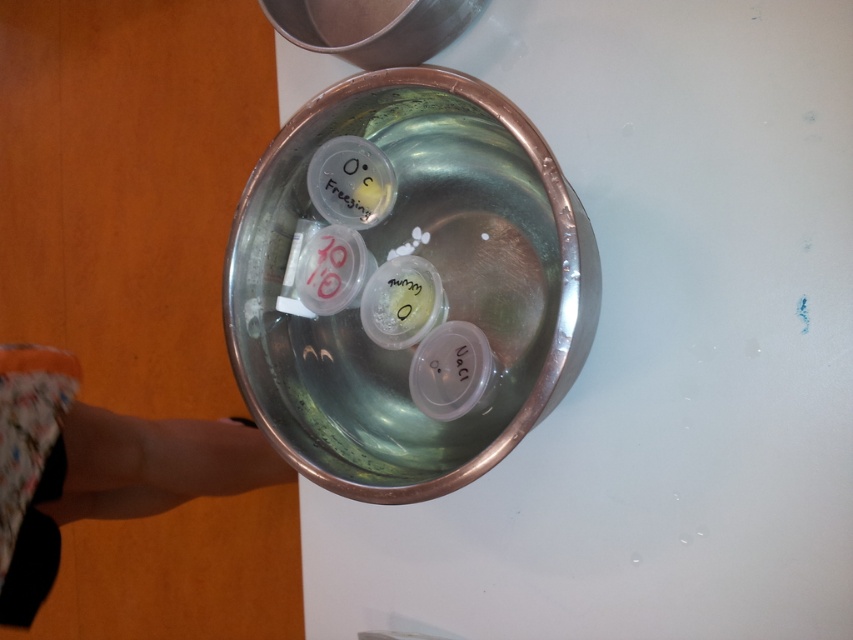
Question: From the image, what is the correct spatial relationship of shiny metallic bowl at center in relation to floral fabric leg at lower left?

Choices:
 (A) below
 (B) above

Answer: (B)

Question: Is shiny metallic bowl at center positioned behind floral fabric leg at lower left?

Choices:
 (A) yes
 (B) no

Answer: (B)

Question: Which point is farther to the camera?

Choices:
 (A) shiny metallic bowl at center
 (B) floral fabric leg at lower left

Answer: (B)

Question: Can you confirm if shiny metallic bowl at center is wider than floral fabric leg at lower left?

Choices:
 (A) no
 (B) yes

Answer: (B)

Question: Which object is farther from the camera taking this photo?

Choices:
 (A) floral fabric leg at lower left
 (B) shiny metallic bowl at center

Answer: (A)

Question: Among these points, which one is farthest from the camera?

Choices:
 (A) (506, 252)
 (B) (102, 419)

Answer: (A)